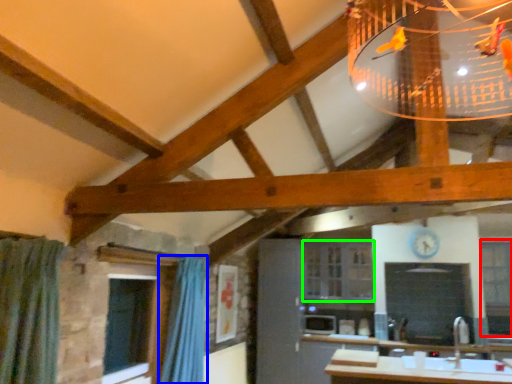
Question: Based on their relative distances, which object is farther from window (highlighted by a red box)? Choose from shower curtain (highlighted by a blue box) and window (highlighted by a green box).

Choices:
 (A) shower curtain
 (B) window

Answer: (A)